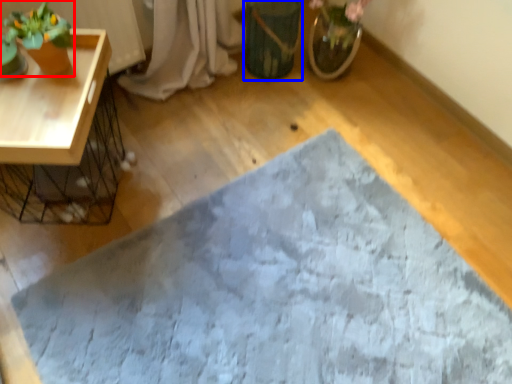
Question: Which object appears closest to the camera in this image, houseplant (highlighted by a red box) or flowerpot (highlighted by a blue box)?

Choices:
 (A) houseplant
 (B) flowerpot

Answer: (A)